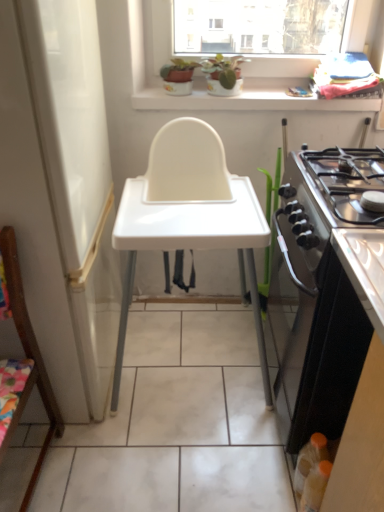
The width and height of the screenshot is (384, 512). I want to click on free region on the left part of translucent plastic bottle at lower right, so click(x=247, y=482).